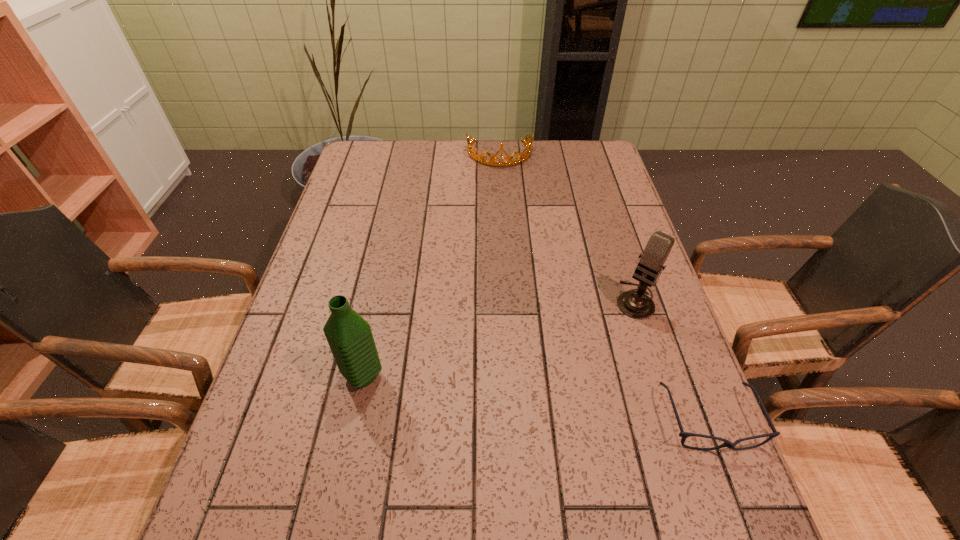
This screenshot has height=540, width=960. What are the coordinates of `vacant region between the third nearest object and the spectacles` in the screenshot? It's located at (672, 360).

Locate an element on the screen. vacant area that lies between the spectacles and the third object from right to left is located at coordinates (605, 287).

This screenshot has height=540, width=960. Find the location of `free area in between the microphone and the shortest object`. free area in between the microphone and the shortest object is located at coordinates (672, 360).

Locate an element on the screen. This screenshot has width=960, height=540. free spot between the second farthest object and the tiara is located at coordinates (567, 227).

Identify which object is the third closest to the water bottle. Please provide its 2D coordinates. Your answer should be formatted as a tuple, i.e. [(x, y)], where the tuple contains the x and y coordinates of a point satisfying the conditions above.

[(519, 158)]

Identify the location of the third closest object relative to the spectacles. (519, 158).

Identify the location of vacant region that satisfies the following two spatial constraints: 1. on the back side of the third nearest object; 2. on the left side of the leftmost object. (379, 300).

Where is `free region that satisfies the following two spatial constraints: 1. on the front side of the third object from right to left; 2. on the left side of the microphone`? The width and height of the screenshot is (960, 540). free region that satisfies the following two spatial constraints: 1. on the front side of the third object from right to left; 2. on the left side of the microphone is located at coordinates (508, 300).